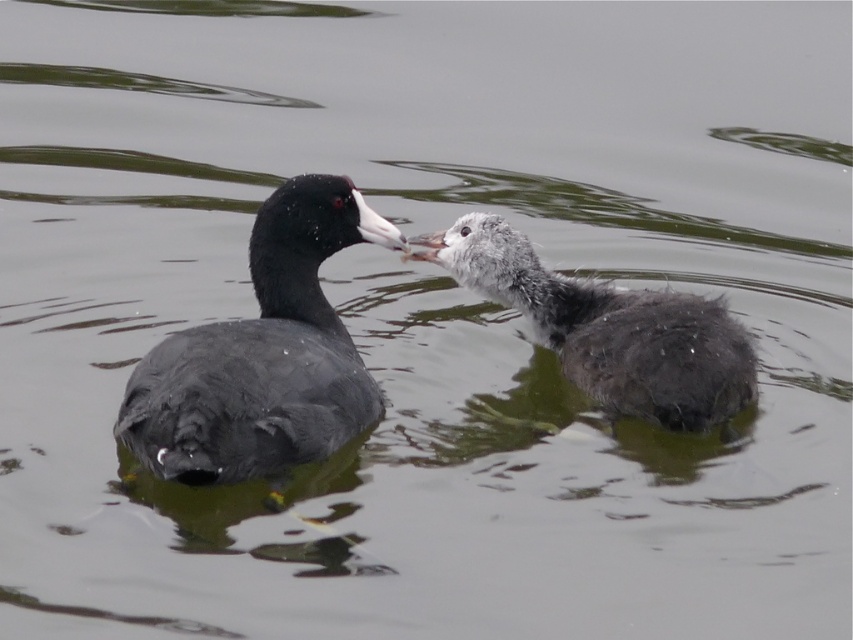
Question: Does matte black duckling at left appear on the right side of gray fluffy duckling at center?

Choices:
 (A) yes
 (B) no

Answer: (B)

Question: Which of the following is the farthest from the observer?

Choices:
 (A) click(271, 198)
 (B) click(722, 406)

Answer: (A)

Question: Is the position of matte black duckling at left more distant than that of gray fluffy duckling at center?

Choices:
 (A) yes
 (B) no

Answer: (B)

Question: Is matte black duckling at left closer to the viewer compared to gray fluffy duckling at center?

Choices:
 (A) yes
 (B) no

Answer: (A)

Question: Which of the following is the closest to the observer?

Choices:
 (A) (430, 259)
 (B) (302, 257)

Answer: (B)